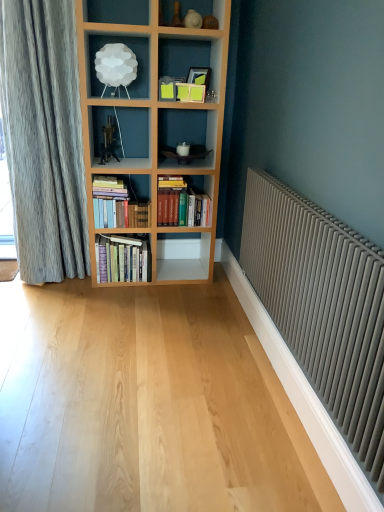
Question: In which direction should I rotate to look at hardcover books at center, the 2th book from the left?

Choices:
 (A) left
 (B) right

Answer: (A)

Question: Is there a large distance between matte gray radiator at right and hardcover books at center, the 2th book from the left?

Choices:
 (A) no
 (B) yes

Answer: (B)

Question: Is matte gray radiator at right taller than hardcover books at center, the 2th book from the left?

Choices:
 (A) yes
 (B) no

Answer: (A)

Question: Does matte gray radiator at right have a lesser width compared to hardcover books at center, which is counted as the 2th book, starting from the right?

Choices:
 (A) yes
 (B) no

Answer: (A)

Question: From the image's perspective, would you say matte gray radiator at right is shown under hardcover books at center, the 2th book from the left?

Choices:
 (A) no
 (B) yes

Answer: (B)

Question: Can you confirm if matte gray radiator at right is wider than hardcover books at center, the 2th book from the left?

Choices:
 (A) yes
 (B) no

Answer: (B)

Question: Is matte gray radiator at right not within hardcover books at center, the 2th book from the left?

Choices:
 (A) no
 (B) yes

Answer: (B)

Question: Is matte gray radiator at right thinner than hardcover books at center, the third book positioned from the right?

Choices:
 (A) yes
 (B) no

Answer: (A)

Question: Considering the relative sizes of matte gray radiator at right and hardcover books at center, which ranks as the first book in left-to-right order, in the image provided, is matte gray radiator at right smaller than hardcover books at center, which ranks as the first book in left-to-right order,?

Choices:
 (A) yes
 (B) no

Answer: (B)

Question: Is matte gray radiator at right touching hardcover books at center, the third book positioned from the right?

Choices:
 (A) no
 (B) yes

Answer: (A)

Question: Could you tell me if matte gray radiator at right is facing hardcover books at center, the third book positioned from the right?

Choices:
 (A) no
 (B) yes

Answer: (A)

Question: Is matte gray radiator at right far away from hardcover books at center, which ranks as the first book in left-to-right order?

Choices:
 (A) no
 (B) yes

Answer: (B)

Question: From a real-world perspective, is matte gray radiator at right physically above hardcover books at center, which ranks as the first book in left-to-right order?

Choices:
 (A) yes
 (B) no

Answer: (A)

Question: Does hardcover books at center, which ranks as the first book in left-to-right order, have a greater height compared to matte gray radiator at right?

Choices:
 (A) yes
 (B) no

Answer: (B)